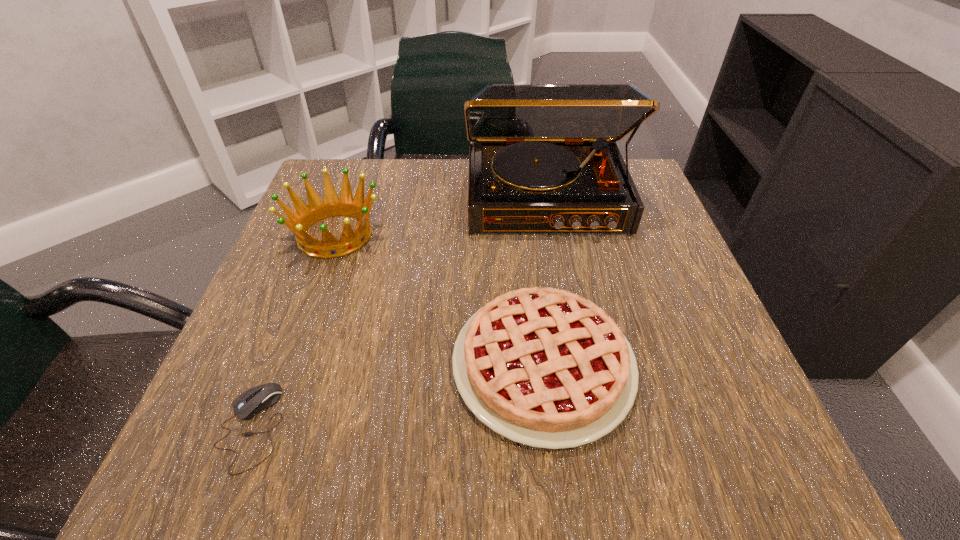
In the image, there is a desktop. Where is `free region at the far edge`? This screenshot has height=540, width=960. free region at the far edge is located at coordinates (407, 194).

Where is `free space at the near edge`? This screenshot has height=540, width=960. free space at the near edge is located at coordinates (348, 426).

The width and height of the screenshot is (960, 540). What are the coordinates of `vacant space at the left edge` in the screenshot? It's located at (288, 315).

This screenshot has height=540, width=960. Find the location of `vacant space at the right edge of the desktop`. vacant space at the right edge of the desktop is located at coordinates (693, 299).

Find the location of `vacant space at the near left corner of the desktop`. vacant space at the near left corner of the desktop is located at coordinates (258, 479).

Find the location of a particular element. This screenshot has width=960, height=540. vacant area between the crown and the pie is located at coordinates (439, 300).

Identify the location of blank region between the pie and the crown. This screenshot has height=540, width=960. (439, 300).

Locate an element on the screen. The image size is (960, 540). vacant area between the pie and the shortest object is located at coordinates (397, 396).

Identify the location of vacant point located between the record player and the shortest object. The width and height of the screenshot is (960, 540). (398, 313).

Where is `vacant space that is in between the tallest object and the second tallest object`? This screenshot has height=540, width=960. vacant space that is in between the tallest object and the second tallest object is located at coordinates (441, 217).